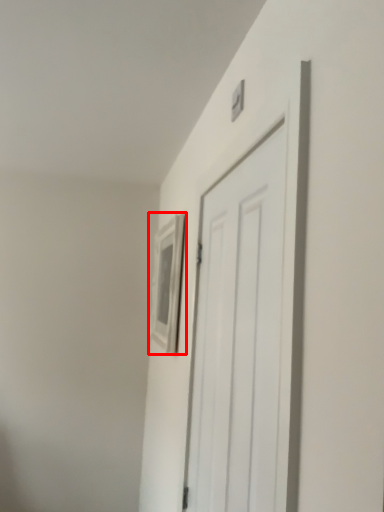
Question: From the image's perspective, considering the relative positions of picture frame (annotated by the red box) and door in the image provided, where is picture frame (annotated by the red box) located with respect to the staircase?

Choices:
 (A) above
 (B) below

Answer: (A)